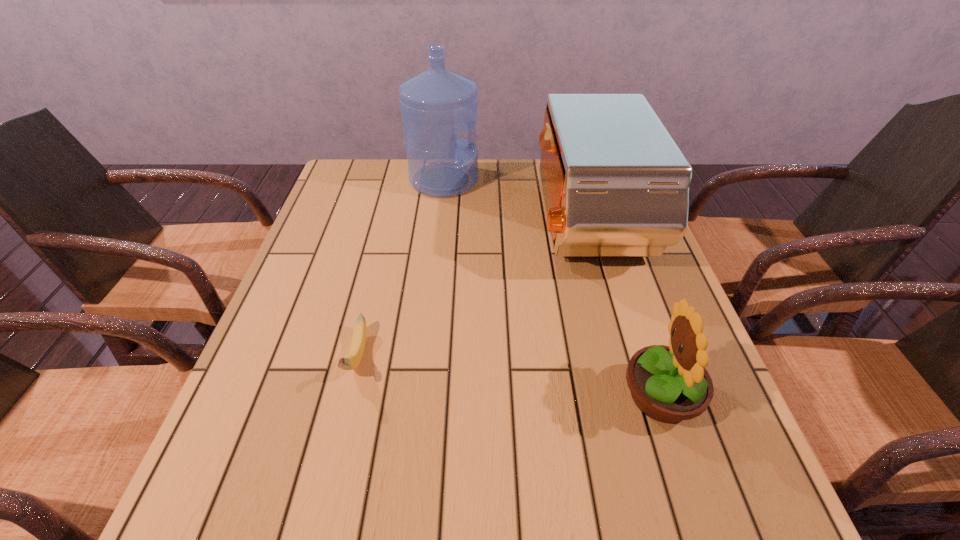
I want to click on unoccupied area between the shortest object and the second shortest object, so click(x=509, y=376).

Find the location of a particular element. free space that is in between the toaster oven and the leftmost object is located at coordinates (472, 291).

I want to click on vacant space in between the third tallest object and the toaster oven, so click(624, 309).

The width and height of the screenshot is (960, 540). I want to click on vacant area between the toaster oven and the leftmost object, so click(x=472, y=291).

The height and width of the screenshot is (540, 960). In order to click on vacant area that lies between the third shortest object and the banana in this screenshot , I will do tap(472, 291).

This screenshot has width=960, height=540. Identify the location of free area in between the toaster oven and the second object from left to right. (516, 202).

Choose which object is the third nearest neighbor to the toaster oven. Please provide its 2D coordinates. Your answer should be formatted as a tuple, i.e. [(x, y)], where the tuple contains the x and y coordinates of a point satisfying the conditions above.

[(351, 361)]

Choose which object is the second nearest neighbor to the water jug. Please provide its 2D coordinates. Your answer should be formatted as a tuple, i.e. [(x, y)], where the tuple contains the x and y coordinates of a point satisfying the conditions above.

[(351, 361)]

Where is `free space in the image that satisfies the following two spatial constraints: 1. on the door side of the third shortest object; 2. at the stem of the shortest object`? Image resolution: width=960 pixels, height=540 pixels. free space in the image that satisfies the following two spatial constraints: 1. on the door side of the third shortest object; 2. at the stem of the shortest object is located at coordinates (625, 356).

Locate an element on the screen. The width and height of the screenshot is (960, 540). vacant region that satisfies the following two spatial constraints: 1. on the door side of the toaster oven; 2. at the stem of the leftmost object is located at coordinates (625, 356).